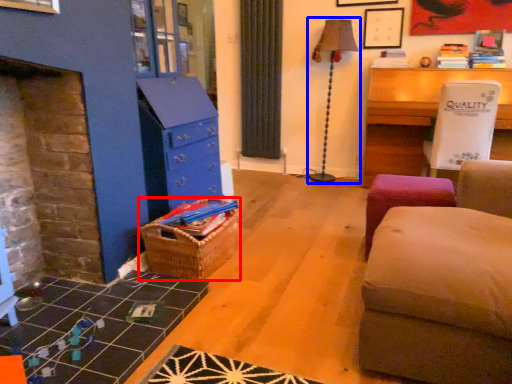
Question: Which point is closer to the camera, crate (highlighted by a red box) or table lamp (highlighted by a blue box)?

Choices:
 (A) crate
 (B) table lamp

Answer: (A)